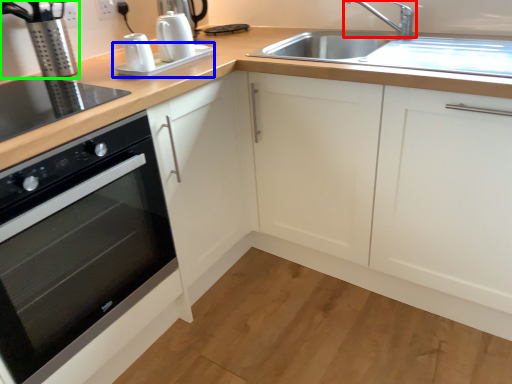
Question: Considering the real-world distances, which object is closest to tap (highlighted by a red box)? appliance (highlighted by a blue box) or coffee machine (highlighted by a green box).

Choices:
 (A) appliance
 (B) coffee machine

Answer: (A)